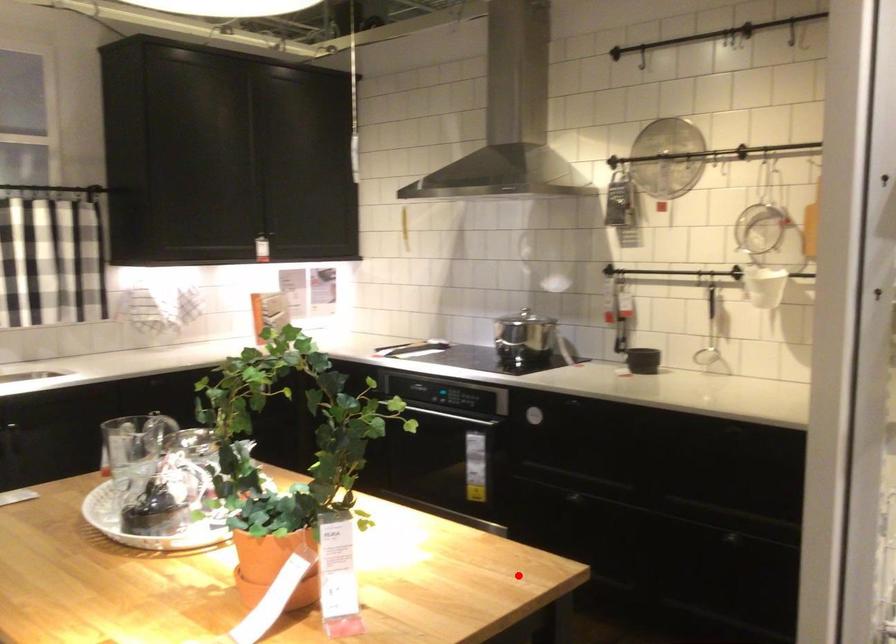
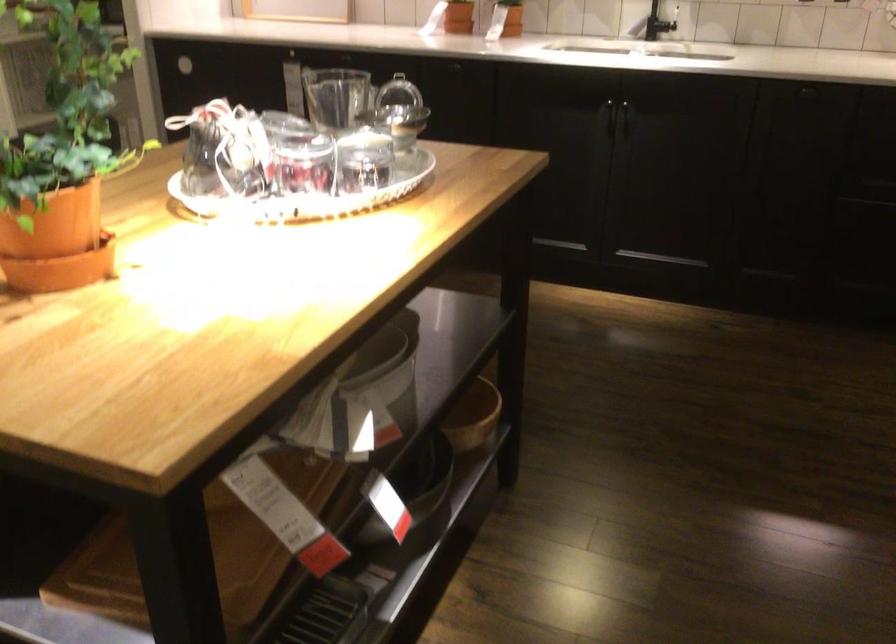
The point at the highlighted location is marked in the first image. Where is the corresponding point in the second image?

(135, 406)